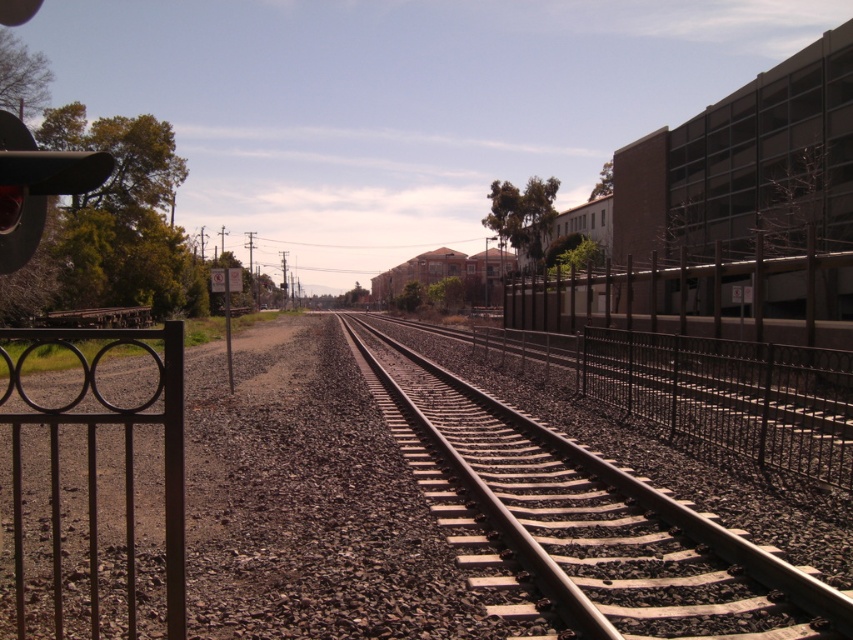
Question: Does smooth metal track at center have a greater width compared to brown metal fence at right?

Choices:
 (A) no
 (B) yes

Answer: (A)

Question: Which point is closer to the camera?

Choices:
 (A) (804, 616)
 (B) (751, 259)
 (C) (178, 465)

Answer: (C)

Question: Which object appears farthest from the camera in this image?

Choices:
 (A) brown metal fence at right
 (B) brown wrought iron gate at left

Answer: (A)

Question: Where is smooth metal track at center located in relation to brown wrought iron gate at left in the image?

Choices:
 (A) right
 (B) left

Answer: (A)

Question: Is the position of smooth metal track at center less distant than that of brown wrought iron gate at left?

Choices:
 (A) yes
 (B) no

Answer: (B)

Question: Among these objects, which one is farthest from the camera?

Choices:
 (A) brown metal fence at right
 (B) smooth metal track at center

Answer: (A)